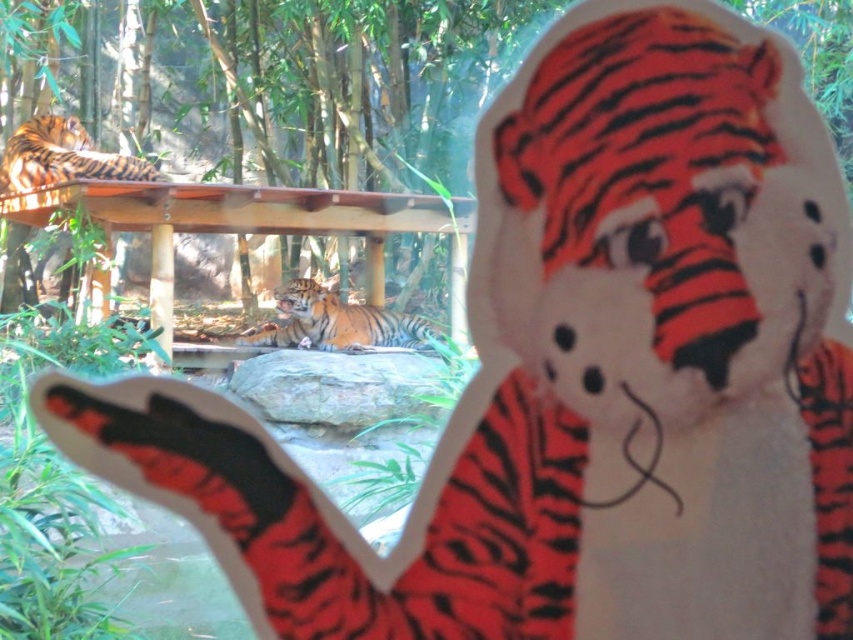
Which of these two, orange striped tiger at center or orange striped tiger at upper left, stands taller?

With more height is orange striped tiger at upper left.

Image resolution: width=853 pixels, height=640 pixels. Describe the element at coordinates (337, 323) in the screenshot. I see `orange striped tiger at center` at that location.

Does point (314, 332) come behind point (57, 115)?

No.

Where is `orange striped tiger at center`? The height and width of the screenshot is (640, 853). orange striped tiger at center is located at coordinates (337, 323).